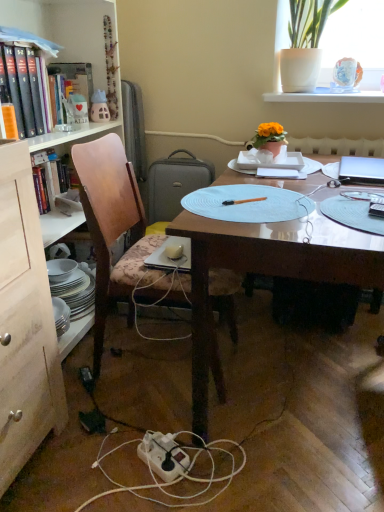
I want to click on free space to the right of white plastic power plugs and sockets at lower center, which appears as the 1th power plugs and sockets when ordered from the bottom, so click(x=136, y=421).